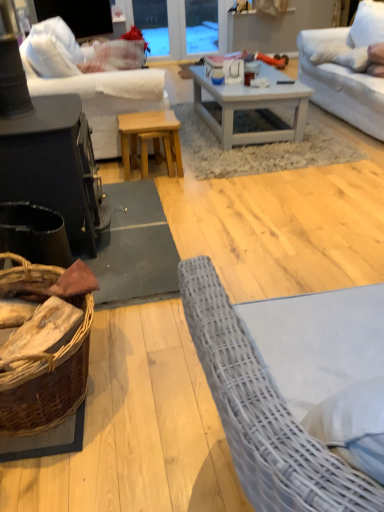
The width and height of the screenshot is (384, 512). Identify the location of vacant area located to the right-hand side of brown woven basket at lower left. (156, 388).